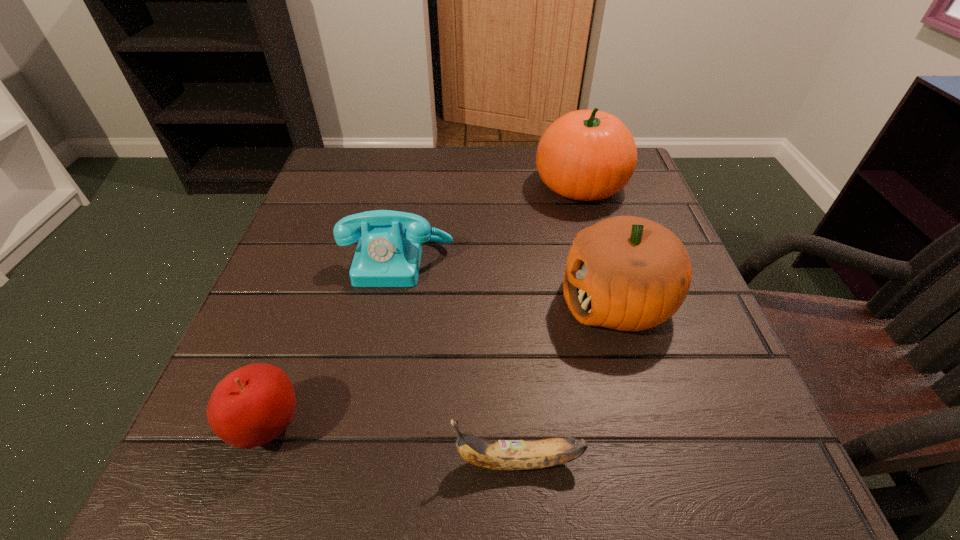
The image size is (960, 540). I want to click on the farthest object, so click(586, 155).

The image size is (960, 540). I want to click on the nearer pumpkin, so click(627, 273).

Find the location of a particular element. The height and width of the screenshot is (540, 960). telephone is located at coordinates (388, 254).

Find the location of a particular element. This screenshot has width=960, height=540. apple is located at coordinates (251, 406).

This screenshot has height=540, width=960. In order to click on the shortest object in this screenshot , I will do `click(510, 455)`.

Identify the location of vacant space located on the front of the farthest object. The height and width of the screenshot is (540, 960). (592, 227).

You are a GUI agent. You are given a task and a screenshot of the screen. Output one action in this format:
    pyautogui.click(x=<x>, y=<y>)
    Task: Click on the blank area located 0.090m on the face of the nearer pumpkin
    
    Given the screenshot: What is the action you would take?
    pyautogui.click(x=510, y=301)

This screenshot has height=540, width=960. In order to click on free location located on the face of the nearer pumpkin in this screenshot , I will do `click(386, 301)`.

At what (x,y) coordinates should I click in order to perform the action: click on free region located on the face of the nearer pumpkin. Please return your answer as a coordinate pair (x, y). This screenshot has height=540, width=960. Looking at the image, I should click on (403, 301).

Identify the location of vacant space located on the dial of the telephone. Image resolution: width=960 pixels, height=540 pixels. (387, 321).